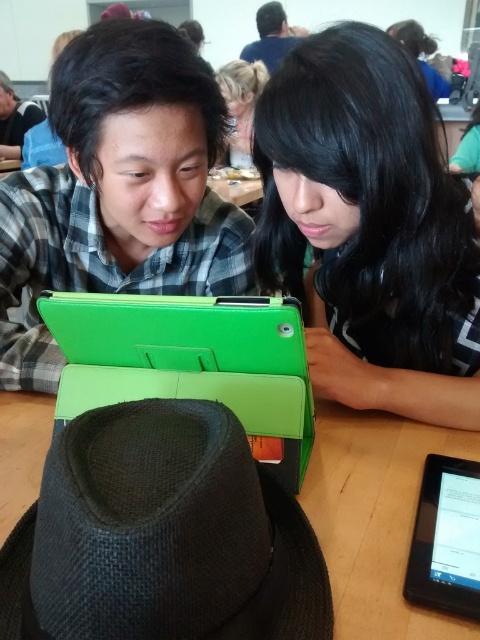
What do you see at coordinates (371, 227) in the screenshot? The height and width of the screenshot is (640, 480). I see `green matte tablet at center` at bounding box center [371, 227].

Can you confirm if green matte tablet at center is smaller than blonde hair at upper center?

Actually, green matte tablet at center might be larger than blonde hair at upper center.

Locate an element on the screen. green matte tablet at center is located at coordinates (371, 227).

Can you confirm if blonde hair at upper center is wider than dark brown hair at upper center?

No, blonde hair at upper center is not wider than dark brown hair at upper center.

Between point (240, 141) and point (264, 54), which one is positioned behind?

The point (264, 54) is more distant.

Locate an element on the screen. The height and width of the screenshot is (640, 480). blonde hair at upper center is located at coordinates (240, 106).

Does green matte tablet at center have a greater width compared to black matte tablet at lower right?

Yes.

Is point (78, 86) farther from camera compared to point (408, 595)?

Yes, point (78, 86) is behind point (408, 595).

The image size is (480, 640). In order to click on green matte tablet at center in this screenshot , I will do `click(371, 227)`.